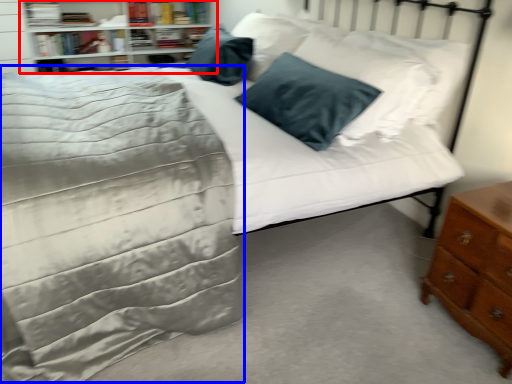
Question: Which of the following is the farthest to the observer, shelf (highlighted by a red box) or bedding (highlighted by a blue box)?

Choices:
 (A) shelf
 (B) bedding

Answer: (A)